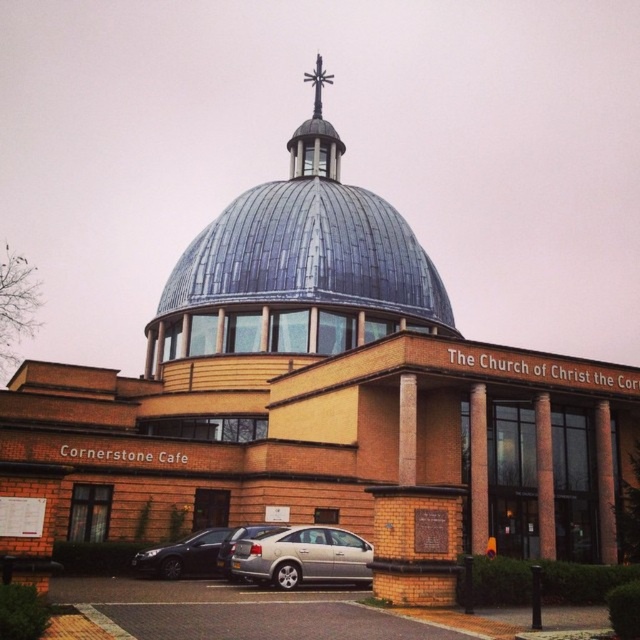
You are standing next to the camera and want to take a photo of the shiny black sedan at lower left. Can you fit the entire sedan into your camera frame without moving closer? The camera has a field of view of 50 degrees and a sensor size of 24mm.

The shiny black sedan at lower left is 38.51 meters away from the camera. Given the camera specifications, the minimum distance required to fit the sedan into the frame can be calculated using the formula distance < sensor size divided by 2 times tangent of half the field of view. Plugging in the numbers, 24mm divided by 2 times tan 25 degrees equals approximately 24mm divided by 2 times 0.4663 equals about 25.75mm. Since 38.51 meters is much greater than 25.75mm, the sedan can be easily fit into the frame.

You are standing at the entrance of the church and want to park your silver metallic car at lower center. The parking spot is located at coordinate point 0.870, 0.473. Can you determine if the car will fit in the parking spot?

The silver metallic car at lower center is located exactly at the coordinate point (x=301, y=556), so the car can fit in the parking spot.